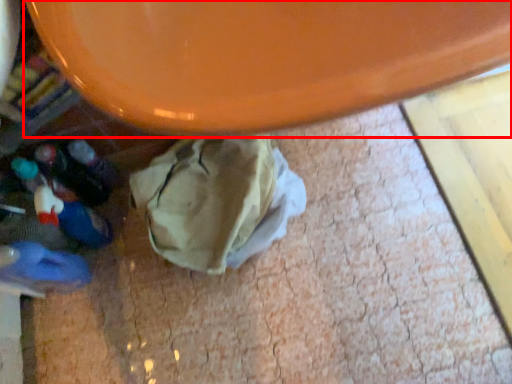
Question: From the image's perspective, where is round table (annotated by the red box) located in relation to footwear in the image?

Choices:
 (A) above
 (B) below

Answer: (A)